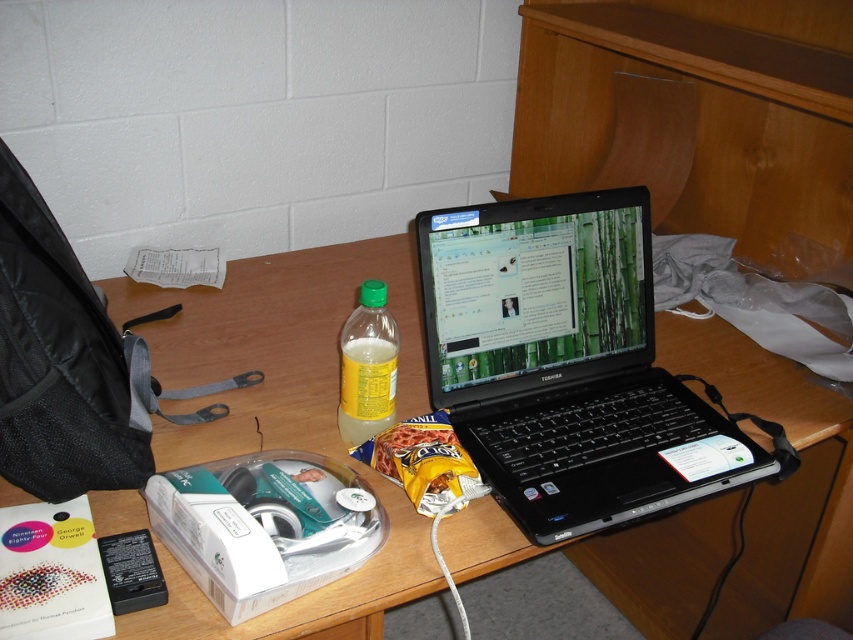
Based on the photo, which is above, wooden at center or black plastic laptop at center?

Positioned higher is black plastic laptop at center.

Does point (836, 586) come behind point (683, 394)?

Yes, it is.

Which is in front, point (724, 595) or point (589, 333)?

Point (589, 333)

The width and height of the screenshot is (853, 640). Find the location of `wooden at center`. wooden at center is located at coordinates (283, 416).

Is point (341, 588) positioned after point (396, 326)?

No, (341, 588) is closer to viewer.

Who is more distant from viewer, (691, 515) or (363, 285)?

Positioned behind is point (691, 515).

At what (x,y) coordinates should I click in order to perform the action: click on wooden at center. Please return your answer as a coordinate pair (x, y). Looking at the image, I should click on (283, 416).

At what (x,y) coordinates should I click in order to perform the action: click on black plastic laptop at center. Please return your answer as a coordinate pair (x, y). Looking at the image, I should click on (566, 364).